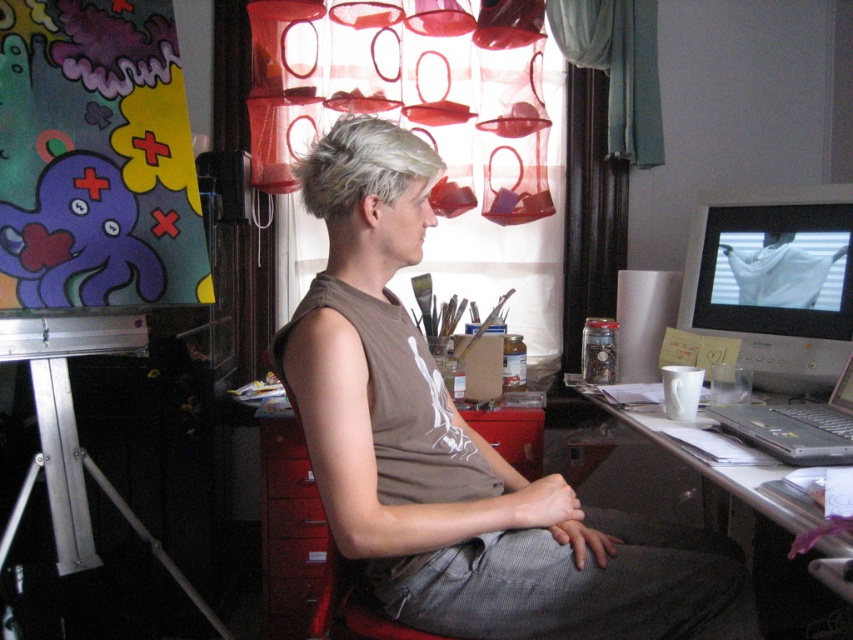
Question: Among these objects, which one is farthest from the camera?

Choices:
 (A) brown cotton tank top at center
 (B) white glossy table at lower right
 (C) gray matte hair at upper center

Answer: (C)

Question: Which object is positioned farthest from the silver metallic laptop at right?

Choices:
 (A) matte black monitor at upper right
 (B) gray matte hair at upper center

Answer: (B)

Question: Can you confirm if white glossy table at lower right is positioned to the right of gray matte hair at upper center?

Choices:
 (A) no
 (B) yes

Answer: (B)

Question: Is matte black monitor at upper right smaller than silver metallic laptop at right?

Choices:
 (A) no
 (B) yes

Answer: (A)

Question: Is brown cotton tank top at center above matte black monitor at upper right?

Choices:
 (A) yes
 (B) no

Answer: (B)

Question: Which of the following is the farthest from the observer?

Choices:
 (A) white glossy table at lower right
 (B) matte black monitor at upper right
 (C) brown cotton tank top at center
 (D) gray matte hair at upper center

Answer: (B)